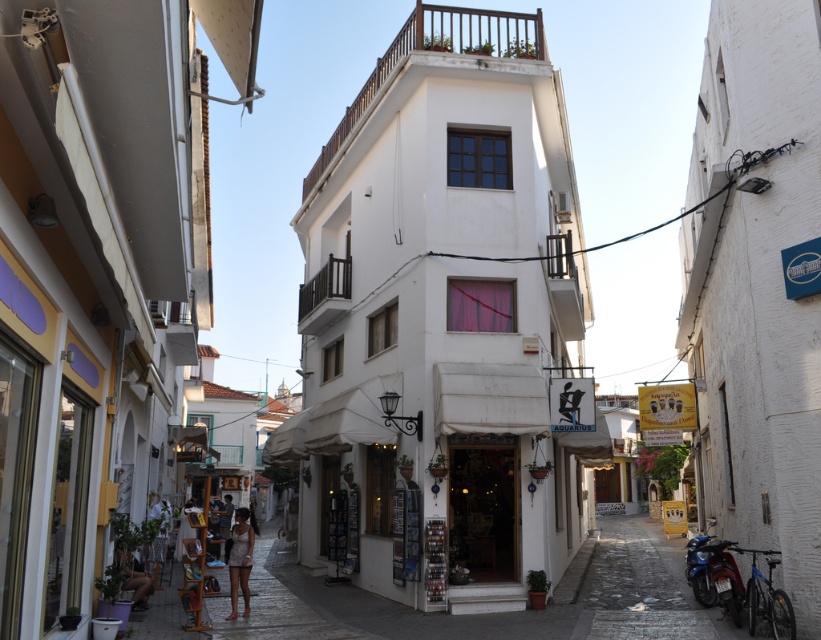
Which is in front, point (241, 522) or point (127, 586)?

Point (127, 586) is in front.

Which is more to the right, white textured dress at center or white cotton dress at lower left?

white textured dress at center

Who is more forward, (232,540) or (120,588)?

Point (120,588)

You are a GUI agent. You are given a task and a screenshot of the screen. Output one action in this format:
    pyautogui.click(x=<x>, y=<y>)
    Task: Click on the white textured dress at center
    Image resolution: width=821 pixels, height=640 pixels.
    Given the screenshot: What is the action you would take?
    pyautogui.click(x=241, y=557)